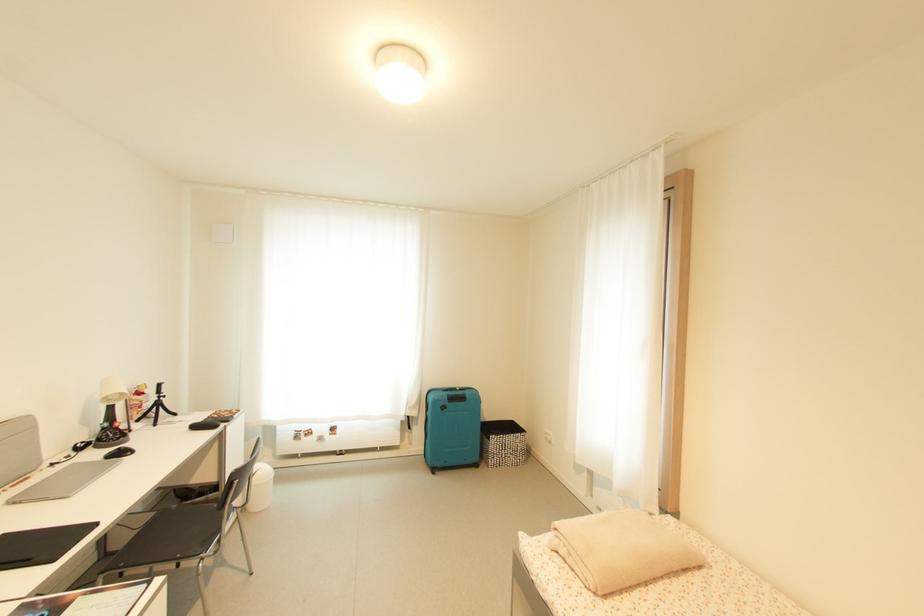
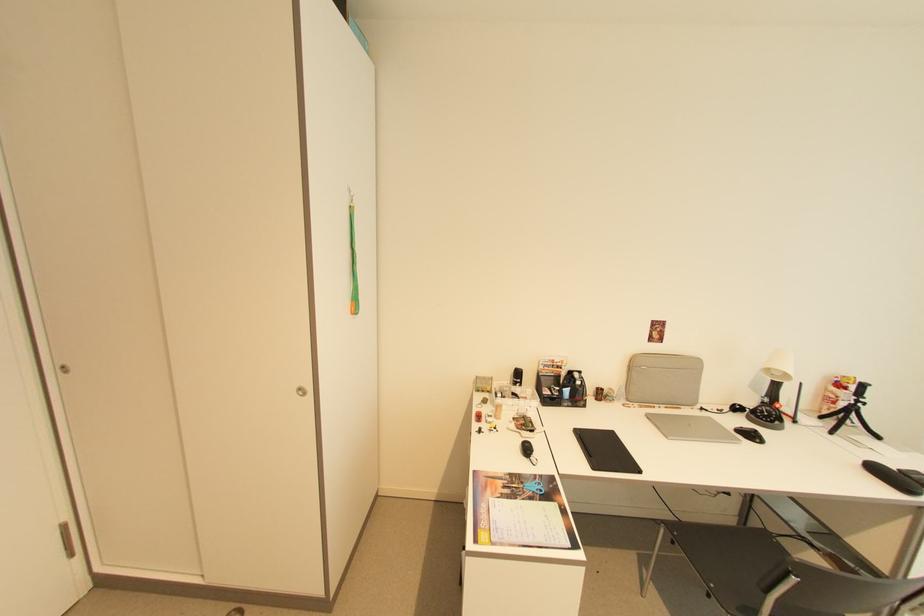
Find the pixel in the second image that matches (x=134, y=455) in the first image.

(762, 442)